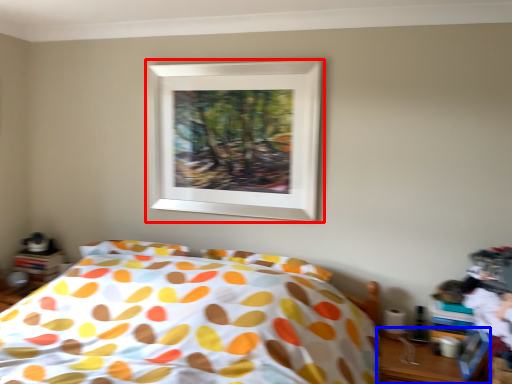
Question: Among these objects, which one is nearest to the camera, picture frame (highlighted by a red box) or table (highlighted by a blue box)?

Choices:
 (A) picture frame
 (B) table

Answer: (B)